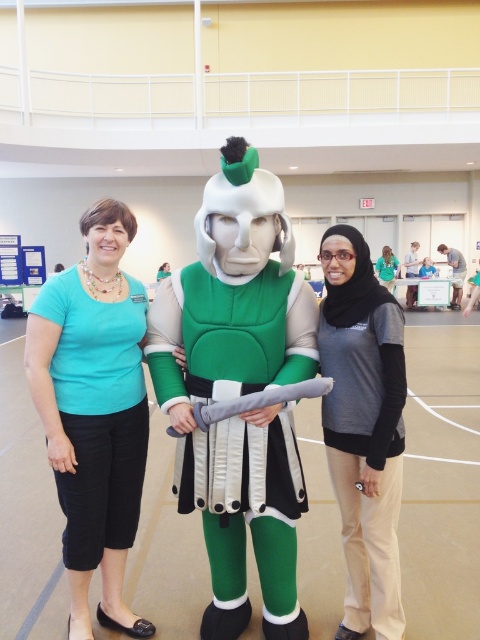
Which is more to the right, green matte costume at center or matte teal shirt at center?

green matte costume at center is more to the right.

Measure the distance between green matte costume at center and matte teal shirt at center.

They are 16.92 inches apart.

Does point (169, 317) lie in front of point (141, 317)?

That is True.

Find the location of a particular element. green matte costume at center is located at coordinates (239, 390).

Is point (87, 298) positioned in front of point (324, 349)?

That is False.

Can you confirm if matte teal shirt at center is thinner than matte gray sweater at center?

Incorrect, matte teal shirt at center's width is not less than matte gray sweater at center's.

Measure the distance between matte teal shirt at center and camera.

matte teal shirt at center and camera are 2.17 meters apart.

At what (x,y) coordinates should I click in order to perform the action: click on matte teal shirt at center. Please return your answer as a coordinate pair (x, y). Looking at the image, I should click on click(x=94, y=412).

In the scene shown: Is green matte costume at center smaller than matte gray sweater at center?

Actually, green matte costume at center might be larger than matte gray sweater at center.

Is point (284, 355) more distant than point (388, 467)?

That is False.

You are a GUI agent. You are given a task and a screenshot of the screen. Output one action in this format:
    pyautogui.click(x=<x>, y=<y>)
    Task: Click on the green matte costume at center
    Image resolution: width=480 pixels, height=640 pixels.
    Given the screenshot: What is the action you would take?
    pyautogui.click(x=239, y=390)